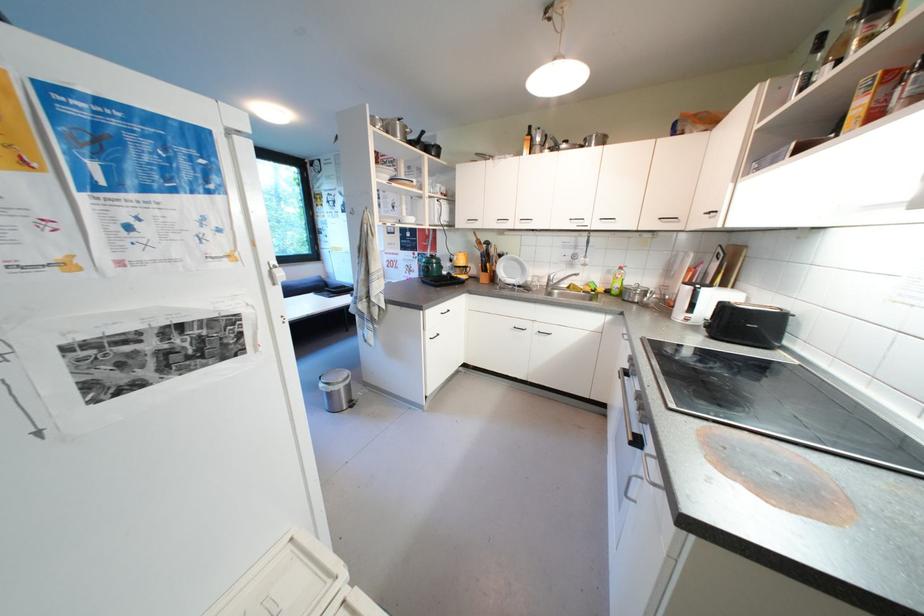
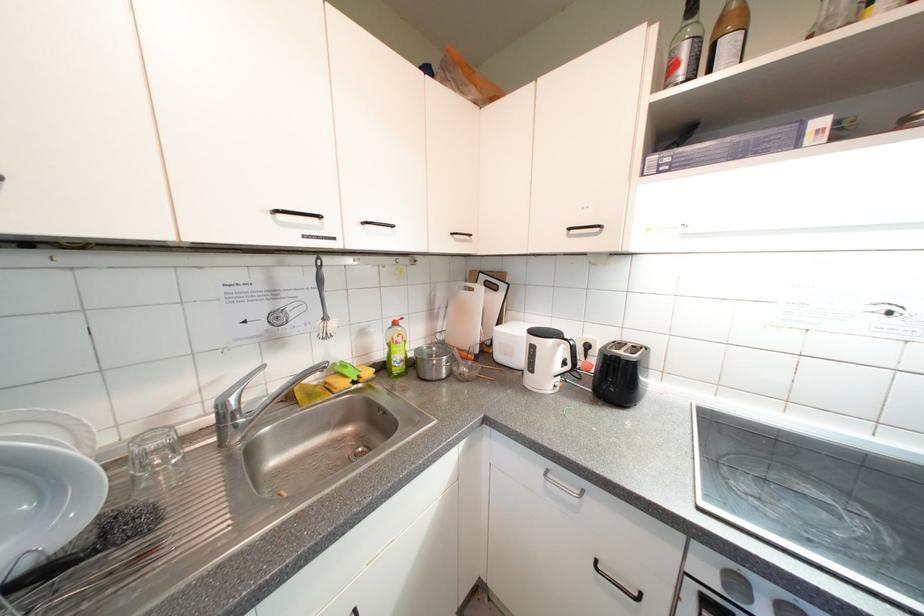
The point at (592, 259) is marked in the first image. Where is the corresponding point in the second image?

(333, 321)